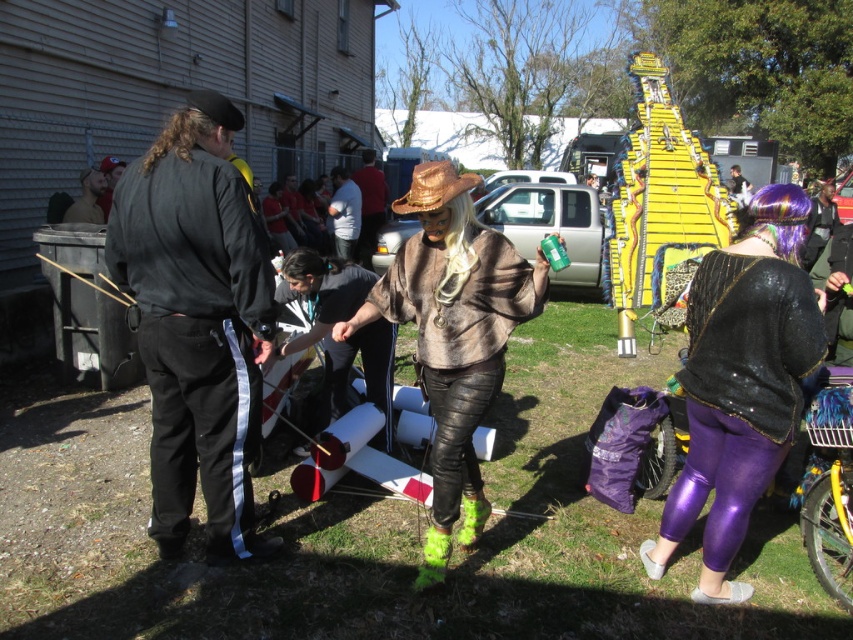
You are a photographer trying to capture a clear shot of both the leather pants at center and the matte black jacket at upper left. Which object should you focus on first to ensure it appears sharp in your photo?

You should focus on the leather pants at center first because it is closer to the viewer than the matte black jacket at upper left, and objects closer to the camera require focusing at different distances.

You are standing at the point marked as point (352, 202) in the image. The distance from you to the nearest building is 11.32 meters. Can you estimate how far you are from the building?

The distance of point (352, 202) from viewer is 11.32 meters, so you are 11.32 meters away from the building.